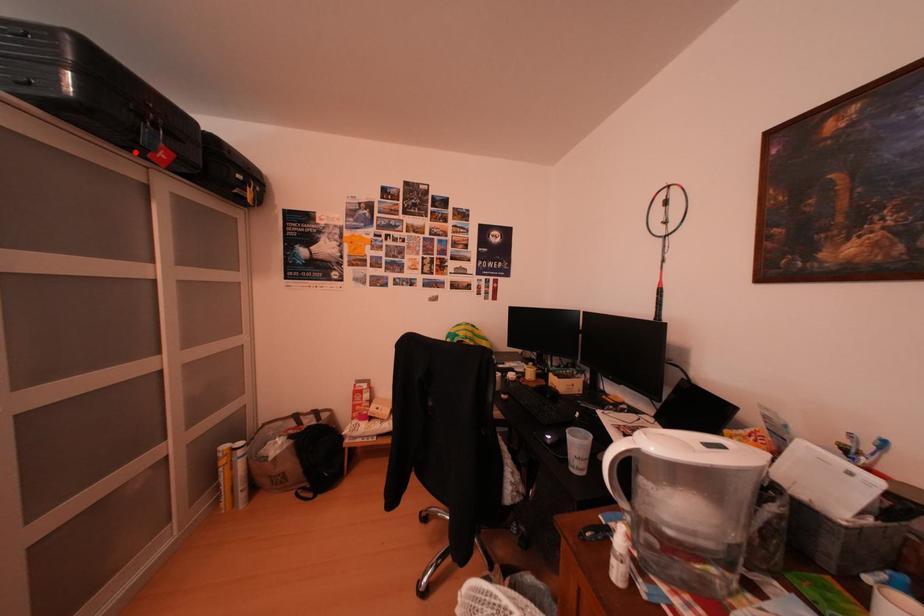
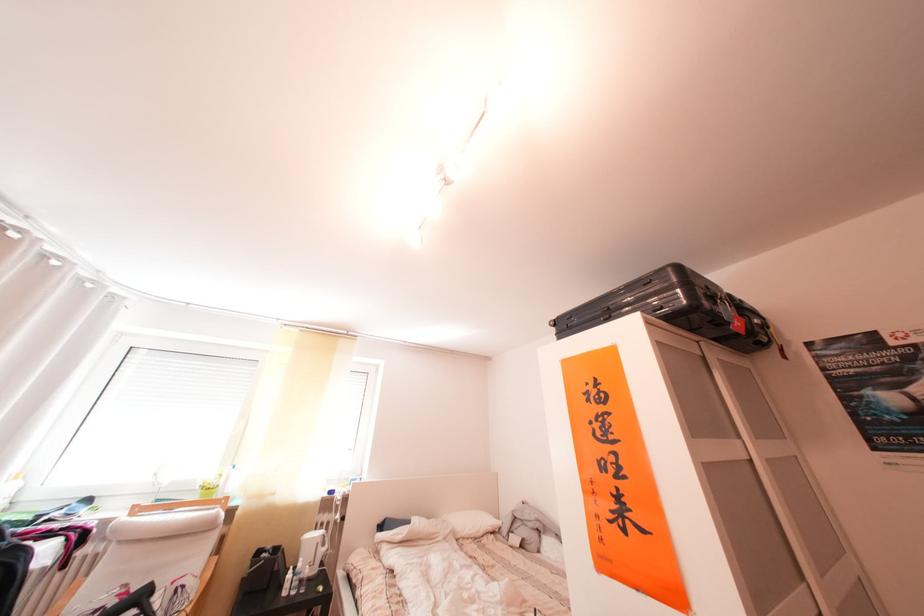
Question: I am providing you with two images of the same scene from different viewpoints. A red point is marked on the first image. Is the red point's position out of view in image 2?

Choices:
 (A) Yes
 (B) No

Answer: (B)